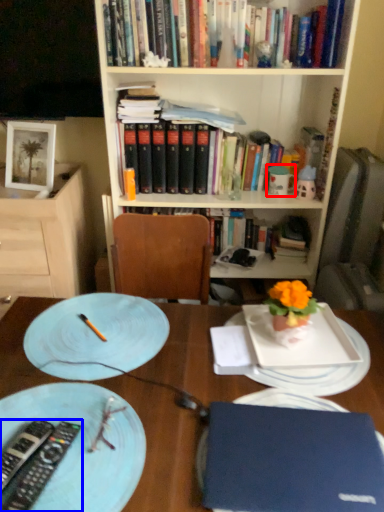
Question: Which of the following is the closest to the observer, tableware (highlighted by a red box) or remote control (highlighted by a blue box)?

Choices:
 (A) tableware
 (B) remote control

Answer: (B)